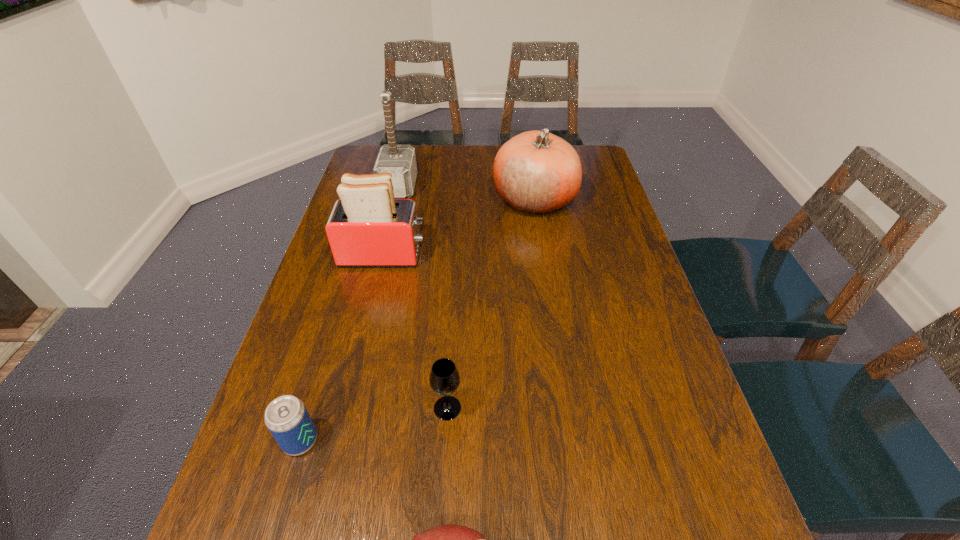
Find the location of `free space at the left edge`. free space at the left edge is located at coordinates (276, 456).

Identify the location of vacant space at the right edge. (637, 428).

This screenshot has height=540, width=960. What are the coordinates of `free space between the tallest object and the wineglass` in the screenshot? It's located at (423, 298).

The width and height of the screenshot is (960, 540). What are the coordinates of `free space that is in between the second shortest object and the hammer` in the screenshot? It's located at (349, 314).

Identify which object is located as the second nearest to the hammer. Please provide its 2D coordinates. Your answer should be formatted as a tuple, i.e. [(x, y)], where the tuple contains the x and y coordinates of a point satisfying the conditions above.

[(536, 172)]

This screenshot has width=960, height=540. In order to click on object that is the fourth closest to the pumpkin in this screenshot , I will do `click(286, 417)`.